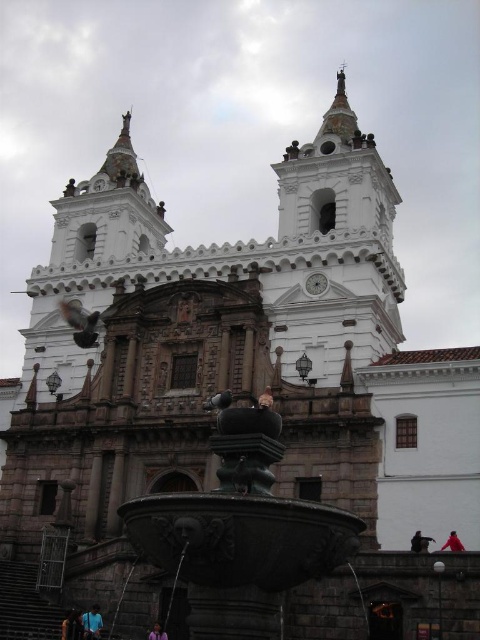
Question: Is black stone fountain at center further to the viewer compared to blue fabric at lower left?

Choices:
 (A) no
 (B) yes

Answer: (A)

Question: In this image, where is blue fabric at lower left located relative to dark brown hair at lower center?

Choices:
 (A) below
 (B) above

Answer: (B)

Question: Among these objects, which one is nearest to the camera?

Choices:
 (A) blue fabric at lower left
 (B) matte gray pigeon at center
 (C) dark brown hair at lower center
 (D) white glossy clock at upper center

Answer: (B)

Question: Which object is the closest to the blue fabric at lower left?

Choices:
 (A) matte black pigeon at center
 (B) black stone fountain at center

Answer: (B)

Question: Does matte gray pigeon at center appear on the right side of red fabric person at lower right?

Choices:
 (A) yes
 (B) no

Answer: (B)

Question: Which point appears closest to the camera in this image?

Choices:
 (A) (317, 564)
 (B) (71, 317)
 (C) (166, 636)

Answer: (A)